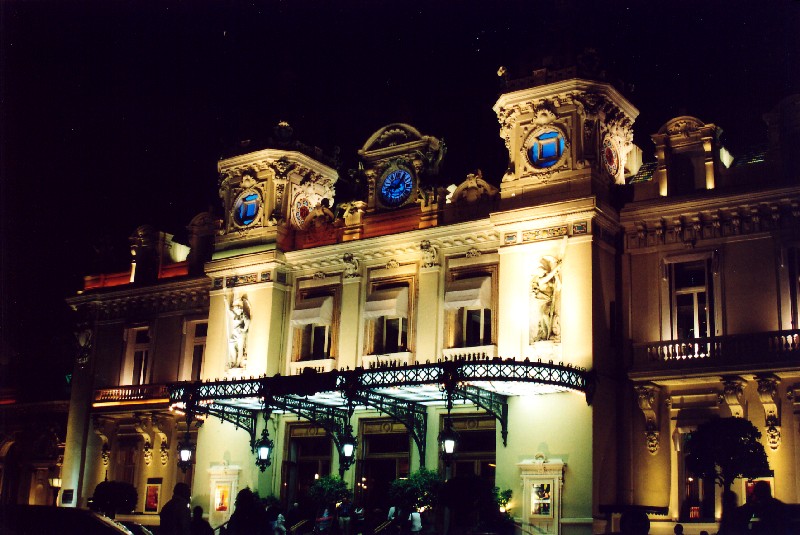
Find the location of a particular element. The width and height of the screenshot is (800, 535). black metal light border is located at coordinates (508, 372), (206, 393).